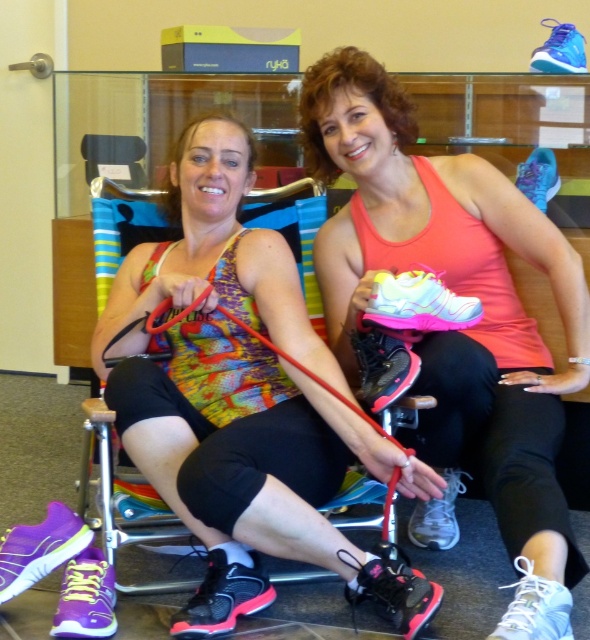
Question: Is pink matte shoe at center further to the viewer compared to rubber/elastic leash at center?

Choices:
 (A) no
 (B) yes

Answer: (A)

Question: Where is multicolored fabric tank top at center located in relation to rubber/elastic leash at center in the image?

Choices:
 (A) below
 (B) above

Answer: (B)

Question: Does multicolored fabric tank top at center lie in front of rubber/elastic leash at center?

Choices:
 (A) no
 (B) yes

Answer: (B)

Question: Considering the real-world distances, which object is closest to the multicolored fabric tank top at center?

Choices:
 (A) pink matte shoe at center
 (B) rubber/elastic leash at center

Answer: (B)

Question: Among these points, which one is nearest to the camera?

Choices:
 (A) (395, 442)
 (B) (453, 528)
 (C) (124, 259)

Answer: (A)

Question: Which of the following is the closest to the observer?

Choices:
 (A) multicolored fabric tank top at center
 (B) rubber/elastic leash at center
 (C) pink matte shoe at center

Answer: (C)